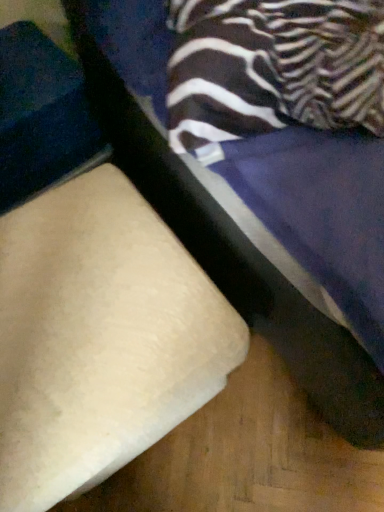
Find the location of a particular element. The image size is (384, 512). free spot above beige fabric cushion at lower left, which is the 1th furniture in left-to-right order (from a real-world perspective) is located at coordinates (78, 302).